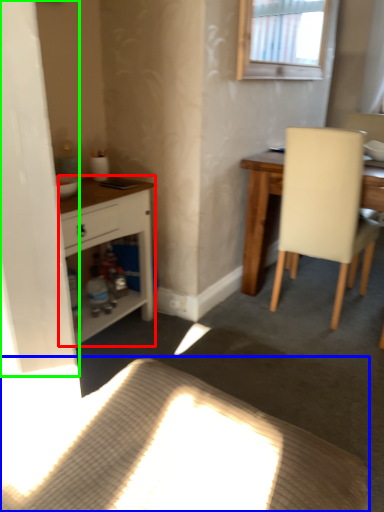
Question: Which is farther away from cabinetry (highlighted by a red box)? plain (highlighted by a blue box) or screen door (highlighted by a green box)?

Choices:
 (A) plain
 (B) screen door

Answer: (A)